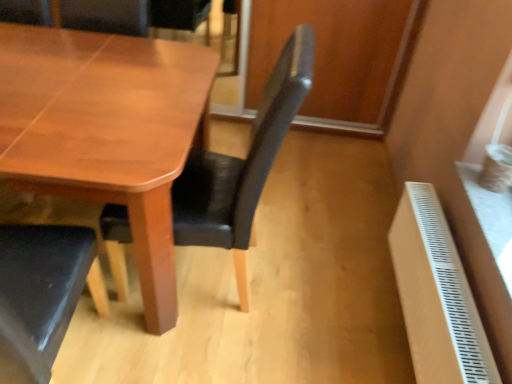
In order to click on spots to the right of wooden table at center in this screenshot , I will do `click(306, 256)`.